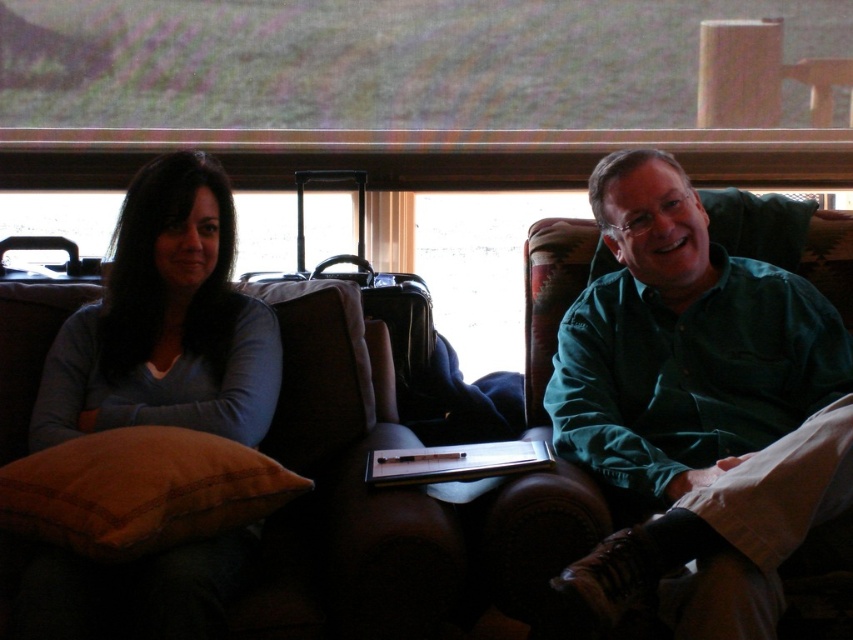
You are standing 6 feet away from the couch where the woman in the light blue top and the man in the teal green shirt are sitting. Is the point at coordinate point [780,296] closer to you than the couch?

The distance of point [780,296] from viewer is 5.94 feet, which is less than 6 feet. Therefore, the point is closer to you than the couch.